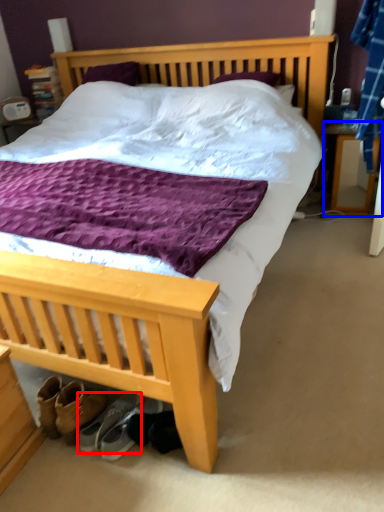
Question: Which object is further to the camera taking this photo, footwear (highlighted by a red box) or nightstand (highlighted by a blue box)?

Choices:
 (A) footwear
 (B) nightstand

Answer: (B)